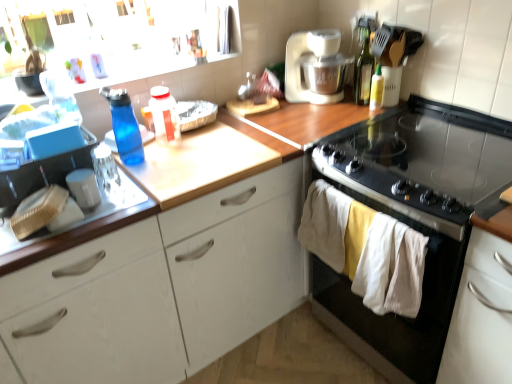
Question: Is wooden at upper center not close to black glass gas stove at upper right?

Choices:
 (A) no
 (B) yes

Answer: (A)

Question: Is black glass gas stove at upper right completely or partially inside wooden at upper center?

Choices:
 (A) no
 (B) yes

Answer: (A)

Question: Could you tell me if wooden at upper center is facing black glass gas stove at upper right?

Choices:
 (A) yes
 (B) no

Answer: (B)

Question: Can you confirm if wooden at upper center is taller than black glass gas stove at upper right?

Choices:
 (A) no
 (B) yes

Answer: (A)

Question: Does wooden at upper center appear on the right side of black glass gas stove at upper right?

Choices:
 (A) yes
 (B) no

Answer: (B)

Question: From the image's perspective, is wooden at upper center over black glass gas stove at upper right?

Choices:
 (A) yes
 (B) no

Answer: (B)

Question: Is blue translucent bottle at left, the fourth bottle from the right, outside of white plastic mixer at upper right?

Choices:
 (A) no
 (B) yes

Answer: (B)

Question: Is blue translucent bottle at left, the fourth bottle from the right, thinner than white plastic mixer at upper right?

Choices:
 (A) yes
 (B) no

Answer: (A)

Question: Considering the relative sizes of blue translucent bottle at left, the fourth bottle from the right, and white plastic mixer at upper right in the image provided, is blue translucent bottle at left, the fourth bottle from the right, taller than white plastic mixer at upper right?

Choices:
 (A) no
 (B) yes

Answer: (A)

Question: Is blue translucent bottle at left, the 1th bottle in the left-to-right sequence, positioned behind white plastic mixer at upper right?

Choices:
 (A) no
 (B) yes

Answer: (A)

Question: Is blue translucent bottle at left, the 1th bottle in the left-to-right sequence, facing towards white plastic mixer at upper right?

Choices:
 (A) yes
 (B) no

Answer: (B)

Question: Are blue translucent bottle at left, the fourth bottle from the right, and white plastic mixer at upper right making contact?

Choices:
 (A) no
 (B) yes

Answer: (A)

Question: From the image's perspective, is white wood cabinet at center, the 1th cabinetry in the left-to-right sequence, above translucent plastic bottle at center, the 3th bottle from the right?

Choices:
 (A) no
 (B) yes

Answer: (A)